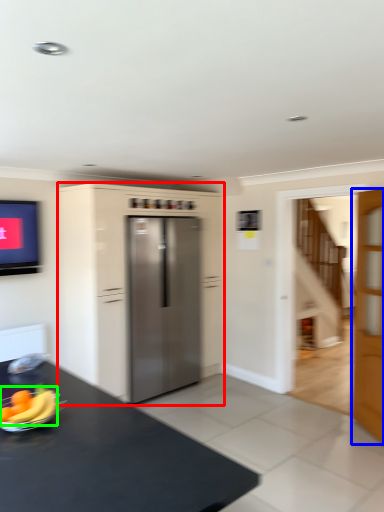
Question: Estimate the real-world distances between objects in this image. Which object is farther from cabinetry (highlighted by a red box), door (highlighted by a blue box) or banana (highlighted by a green box)?

Choices:
 (A) door
 (B) banana

Answer: (B)